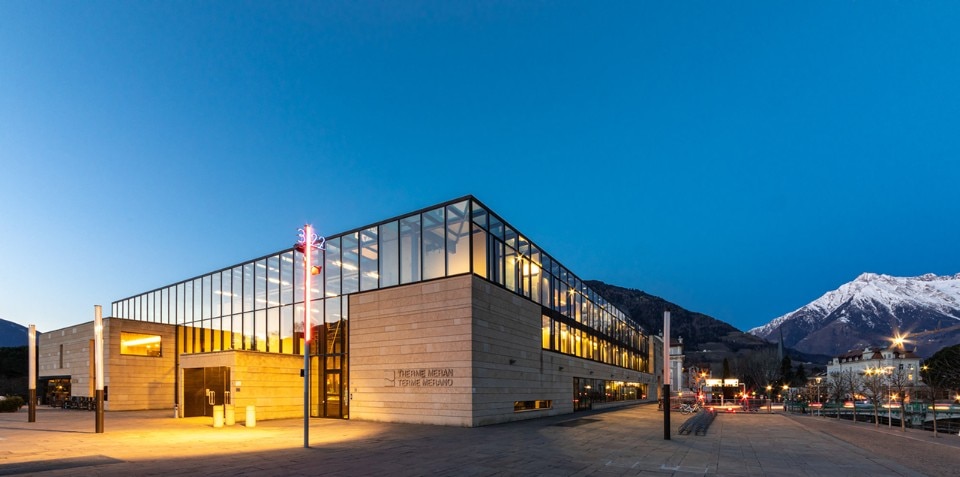
The height and width of the screenshot is (477, 960). I want to click on doors, so [x=194, y=389], [x=218, y=386].